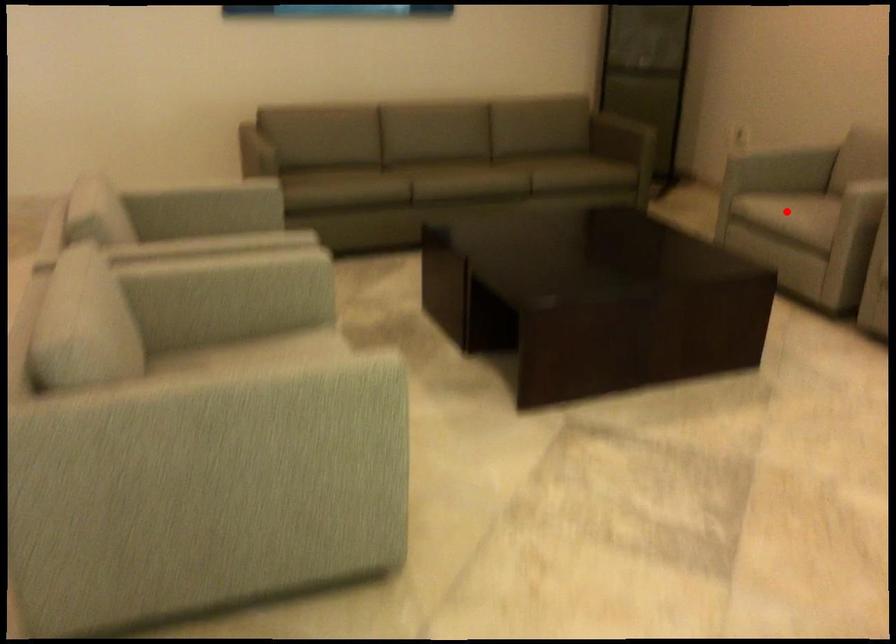
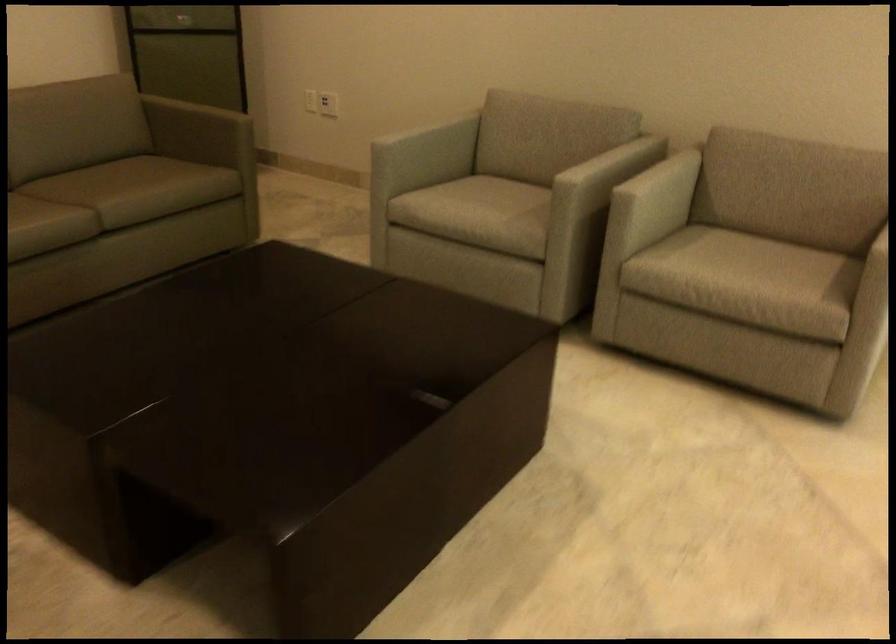
Question: A red point is marked in image1. In image2, is the corresponding 3D point closer to the camera or farther? Reply with the corresponding letter.

Choices:
 (A) The corresponding 3D point is closer.
 (B) The corresponding 3D point is farther.

Answer: (A)